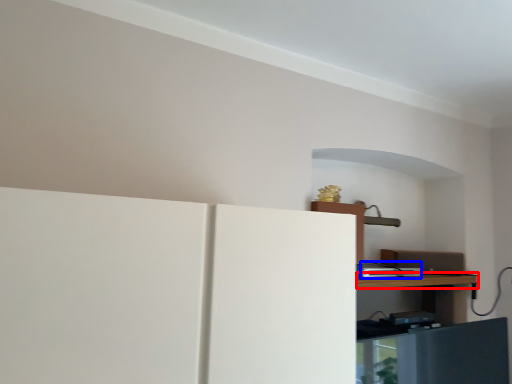
Question: Among these objects, which one is farthest to the camera, table (highlighted by a red box) or appliance (highlighted by a blue box)?

Choices:
 (A) table
 (B) appliance

Answer: (B)